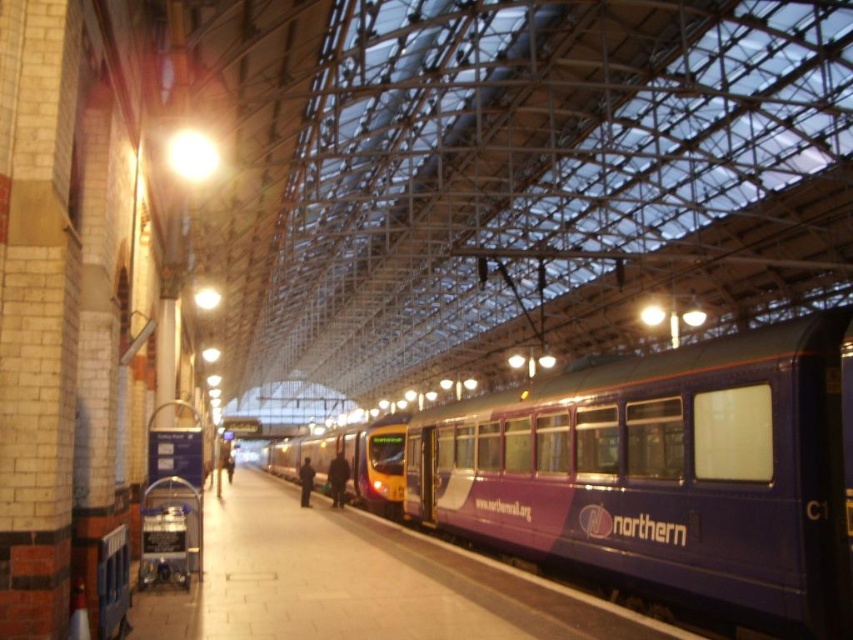
Question: Among these points, which one is nearest to the camera?

Choices:
 (A) (302, 483)
 (B) (762, 532)

Answer: (B)

Question: Considering the real-world distances, which object is closest to the dark blue fabric jacket at center?

Choices:
 (A) purple glossy train at center
 (B) dark blue jacket at platform center

Answer: (B)

Question: Which point is closer to the camera?

Choices:
 (A) (341, 452)
 (B) (664, 550)

Answer: (B)

Question: Is dark blue fabric jacket at center behind dark blue jacket at platform center?

Choices:
 (A) no
 (B) yes

Answer: (B)

Question: Is purple glossy train at center in front of dark blue fabric jacket at center?

Choices:
 (A) yes
 (B) no

Answer: (A)

Question: Can you confirm if purple glossy train at center is positioned to the right of dark blue fabric jacket at center?

Choices:
 (A) yes
 (B) no

Answer: (A)